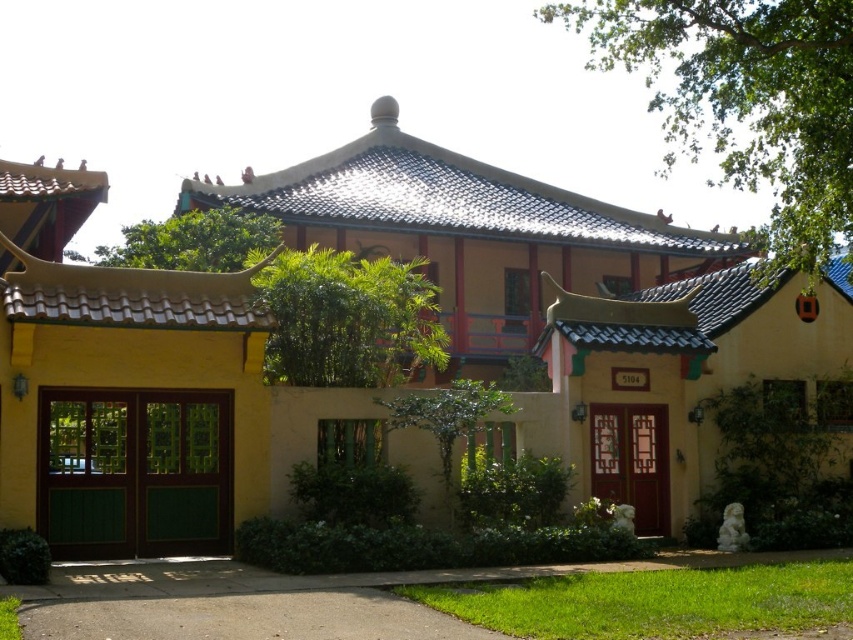
Is green leafy tree at upper center positioned at the back of green leafy tree at center?

Yes, it is behind green leafy tree at center.

Who is positioned more to the right, green leafy tree at upper center or green leafy tree at center?

Positioned to the right is green leafy tree at center.

You are a GUI agent. You are given a task and a screenshot of the screen. Output one action in this format:
    pyautogui.click(x=<x>, y=<y>)
    Task: Click on the green leafy tree at upper center
    The height and width of the screenshot is (640, 853).
    Given the screenshot: What is the action you would take?
    pyautogui.click(x=190, y=241)

Does green leafy tree at upper right come in front of green leafy tree at upper center?

Yes, it is in front of green leafy tree at upper center.

Is point (721, 144) more distant than point (109, 260)?

That is False.

This screenshot has height=640, width=853. What are the coordinates of `green leafy tree at upper right` in the screenshot? It's located at (746, 100).

Does green leafy tree at upper right have a greater height compared to green leafy tree at center?

Yes.

Does point (672, 48) come in front of point (445, 394)?

No, (672, 48) is behind (445, 394).

At what (x,y) coordinates should I click in order to perform the action: click on green leafy tree at upper right. Please return your answer as a coordinate pair (x, y). Looking at the image, I should click on (746, 100).